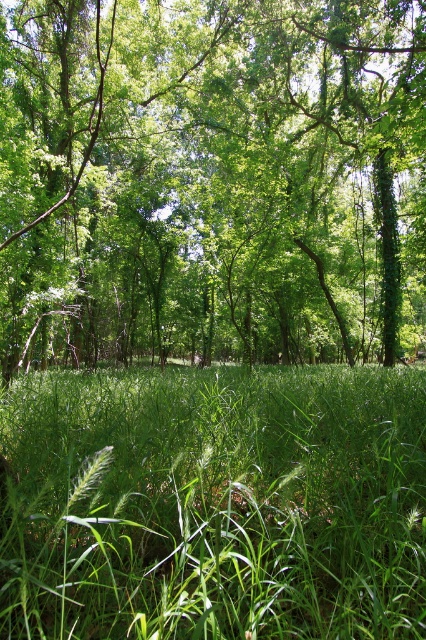
Question: Is green leafy tree at center positioned behind green grassy at center?

Choices:
 (A) no
 (B) yes

Answer: (B)

Question: Is green leafy tree at center bigger than green grassy at center?

Choices:
 (A) yes
 (B) no

Answer: (A)

Question: Does green leafy tree at center have a lesser width compared to green grassy at center?

Choices:
 (A) yes
 (B) no

Answer: (B)

Question: Which point is farther from the camera taking this photo?

Choices:
 (A) (331, 147)
 (B) (187, 372)

Answer: (A)

Question: Which of the following is the closest to the observer?

Choices:
 (A) click(x=78, y=26)
 (B) click(x=351, y=426)

Answer: (B)

Question: Among these points, which one is nearest to the camera?

Choices:
 (A) (328, 573)
 (B) (298, 198)

Answer: (A)